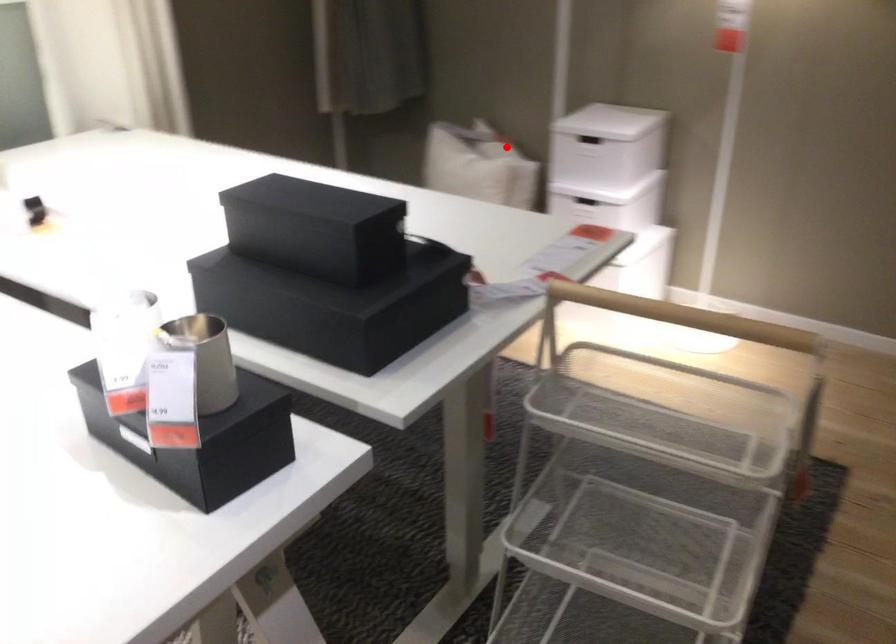
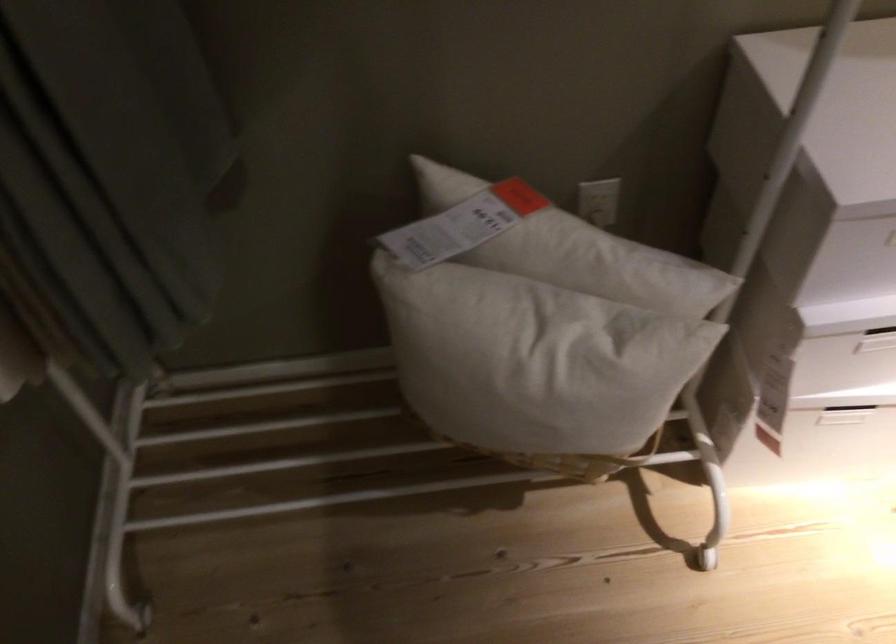
Question: I am providing you with two images of the same scene from different viewpoints. Image1 has a red point marked. In image2, the corresponding 3D location appears at what relative position? Reply with the corresponding letter.

Choices:
 (A) Closer
 (B) Farther

Answer: (A)